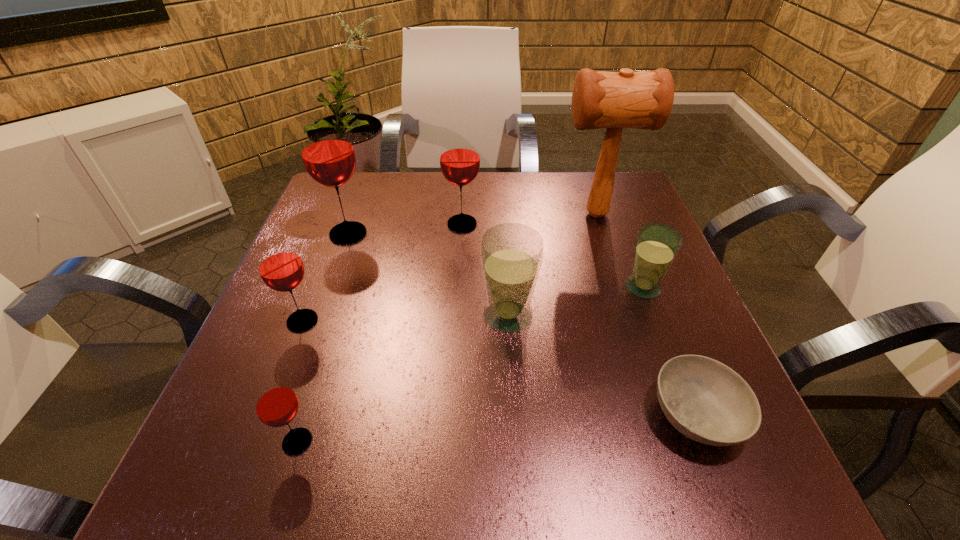
Locate an element on the screen. object that is at the far right corner is located at coordinates (626, 99).

Identify the location of object that is at the near right corner. (705, 400).

This screenshot has width=960, height=540. Identify the location of vacant region at the far edge of the desktop. (468, 201).

You are a GUI agent. You are given a task and a screenshot of the screen. Output one action in this format:
    pyautogui.click(x=<x>, y=<y>)
    Task: Click on the vacant region at the near edge of the desktop
    
    Given the screenshot: What is the action you would take?
    pyautogui.click(x=603, y=496)

At what (x,y) coordinates should I click in order to perform the action: click on vacant space at the left edge. Please return your answer as a coordinate pair (x, y). Looking at the image, I should click on (305, 308).

The image size is (960, 540). I want to click on vacant space at the right edge of the desktop, so click(x=660, y=347).

What are the coordinates of `vacant region at the far left corner of the desktop` in the screenshot? It's located at (382, 173).

You are a GUI agent. You are given a task and a screenshot of the screen. Output one action in this format:
    pyautogui.click(x=<x>, y=<y>)
    Task: Click on the vacant area between the bigger blue glass and the third farthest red glass
    Image resolution: width=960 pixels, height=540 pixels.
    Given the screenshot: What is the action you would take?
    pyautogui.click(x=405, y=318)

Find the location of a particular element. The image size is (960, 540). free spot between the tallest glass and the third biggest red glass is located at coordinates (325, 278).

Locate an element on the screen. This screenshot has height=540, width=960. vacant point located between the tallest object and the fifth shortest glass is located at coordinates [x=529, y=219].